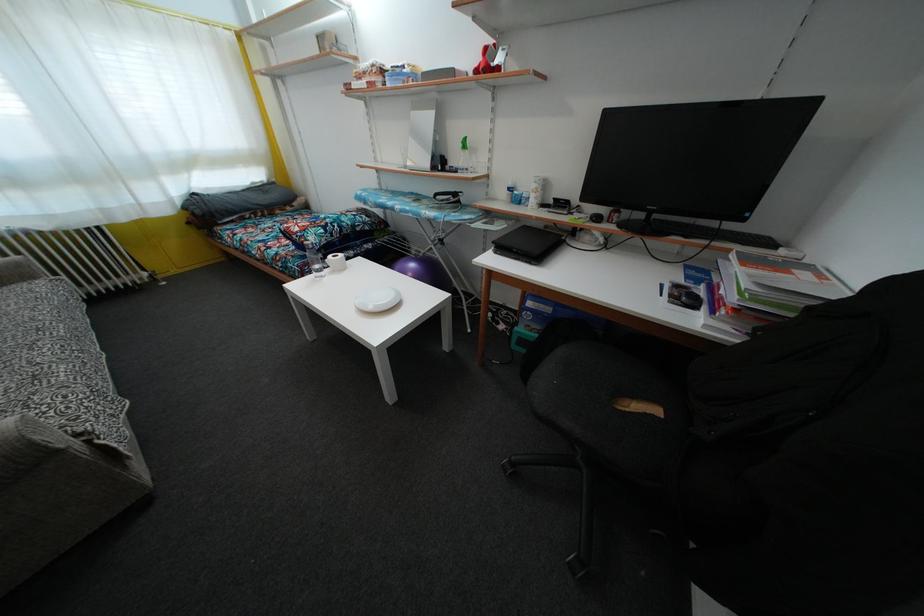
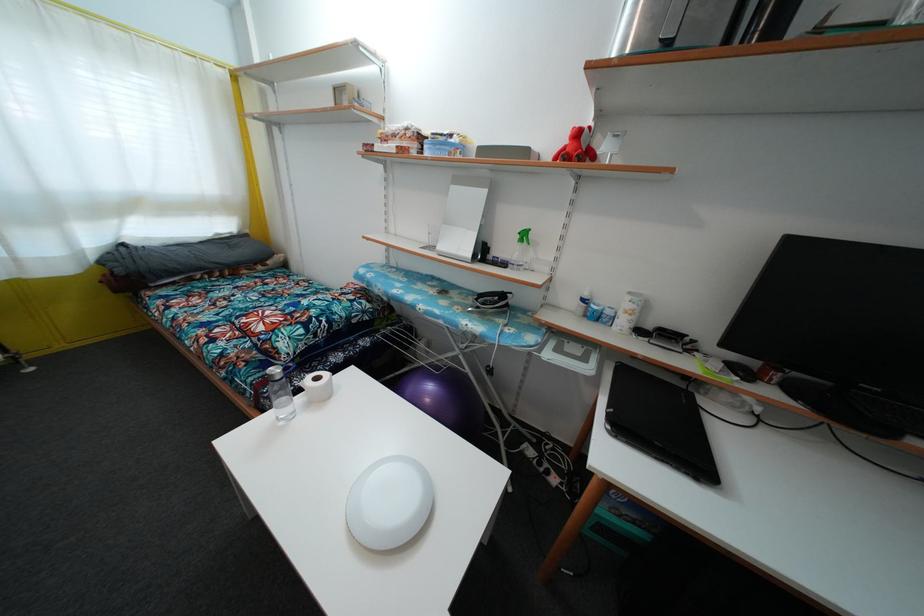
In the second image, find the point that corresponds to [314,253] in the first image.

(282, 384)